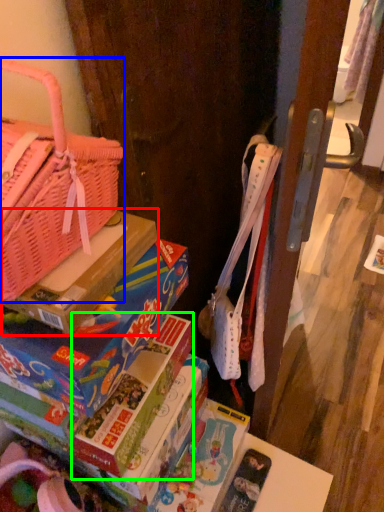
Question: Considering the real-world distances, which object is farthest from cardboard box (highlighted by a red box)? handbag (highlighted by a blue box) or paperback book (highlighted by a green box)?

Choices:
 (A) handbag
 (B) paperback book

Answer: (B)